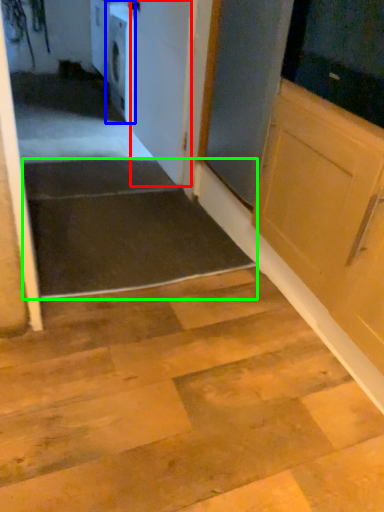
Question: Based on their relative distances, which object is nearer to door (highlighted by a red box)? Choose from dish washer (highlighted by a blue box) and stairwell (highlighted by a green box).

Choices:
 (A) dish washer
 (B) stairwell

Answer: (B)